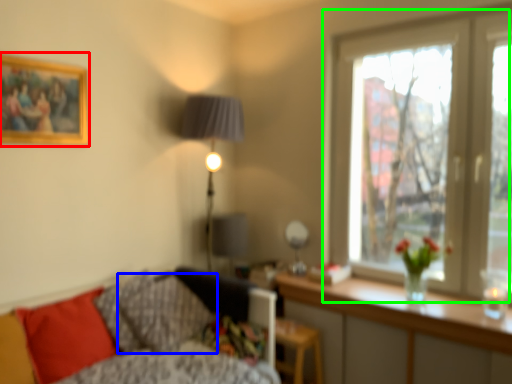
Question: Which object is positioned farthest from picture frame (highlighted by a red box)? Select from pillow (highlighted by a blue box) and window (highlighted by a green box).

Choices:
 (A) pillow
 (B) window

Answer: (B)